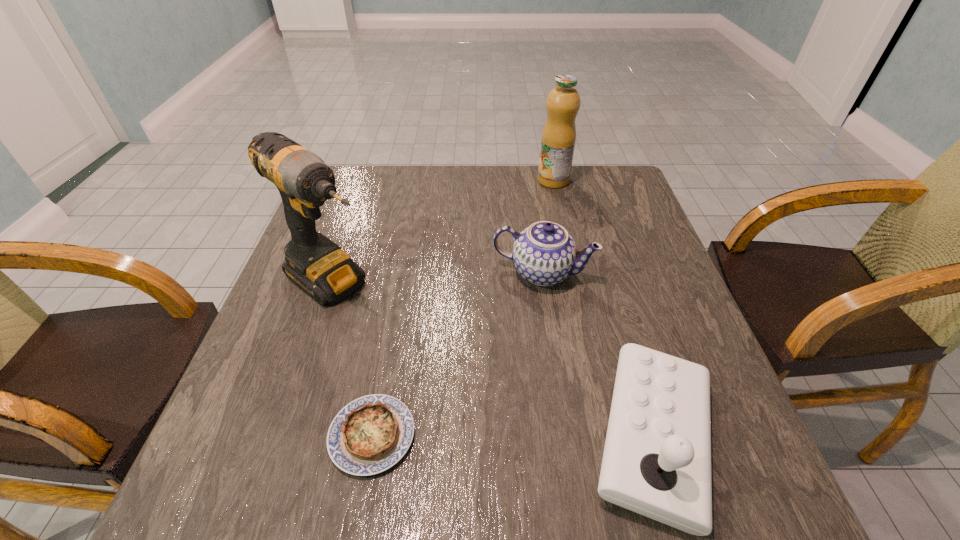
Where is `free space located 0.150m with the drill bit of the drill facing forward`? free space located 0.150m with the drill bit of the drill facing forward is located at coordinates (415, 336).

At what (x,y) coordinates should I click in order to perform the action: click on free space located on the front label of the farthest object. Please return your answer as a coordinate pair (x, y). The height and width of the screenshot is (540, 960). Looking at the image, I should click on (548, 212).

The height and width of the screenshot is (540, 960). I want to click on vacant space located 0.070m on the front label of the farthest object, so click(x=550, y=202).

The width and height of the screenshot is (960, 540). I want to click on vacant area located 0.140m on the front label of the farthest object, so click(547, 217).

Locate an element on the screen. This screenshot has width=960, height=540. object situated at the far edge is located at coordinates (558, 139).

The image size is (960, 540). I want to click on object at the near edge, so click(x=369, y=435).

Image resolution: width=960 pixels, height=540 pixels. Find the location of `object located in the left edge section of the desktop`. object located in the left edge section of the desktop is located at coordinates (317, 265).

The image size is (960, 540). What are the coordinates of `vacant space at the far edge of the desktop` in the screenshot? It's located at (434, 179).

Find the location of a particular element. The height and width of the screenshot is (540, 960). vacant space at the near edge of the desktop is located at coordinates (489, 416).

You are a GUI agent. You are given a task and a screenshot of the screen. Output one action in this format:
    pyautogui.click(x=<x>, y=<y>)
    Task: Click on the vacant space at the left edge of the desktop
    This screenshot has height=540, width=960.
    Given the screenshot: What is the action you would take?
    pyautogui.click(x=296, y=330)